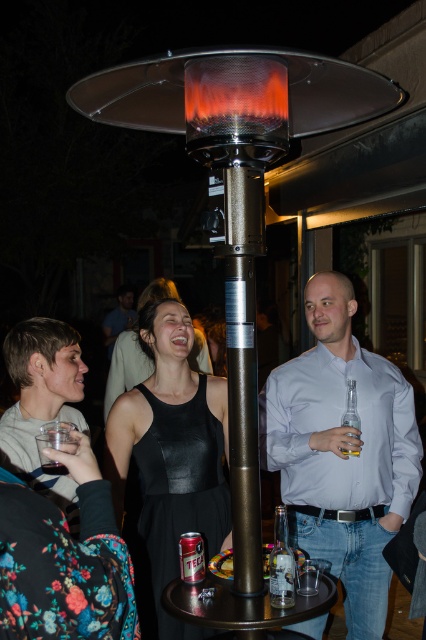
Who is lower down, metallic silver pole at center or clear plastic cup at lower left?

Positioned lower is clear plastic cup at lower left.

Does metallic silver pole at center have a smaller size compared to clear plastic cup at lower left?

Incorrect, metallic silver pole at center is not smaller in size than clear plastic cup at lower left.

Where is `metallic silver pole at center`? metallic silver pole at center is located at coordinates (242, 365).

Find the location of a particular element. The width and height of the screenshot is (426, 640). metallic silver pole at center is located at coordinates (242, 365).

Does light blue shirt at center appear on the right side of floral fabric dress at lower left?

Yes, light blue shirt at center is to the right of floral fabric dress at lower left.

Does point (267, 449) come behind point (78, 464)?

Yes, point (267, 449) is behind point (78, 464).

Where is `light blue shirt at center`? The height and width of the screenshot is (640, 426). light blue shirt at center is located at coordinates (340, 452).

Looking at this image, which of these two, black leather dress at center or clear plastic cup at lower left, stands shorter?

clear plastic cup at lower left

Is point (131, 388) positioned after point (62, 444)?

Yes, it is.

Image resolution: width=426 pixels, height=640 pixels. Find the location of `black leather dress at center`. black leather dress at center is located at coordinates (172, 451).

Identify the location of black leather dress at center. This screenshot has height=640, width=426. (172, 451).